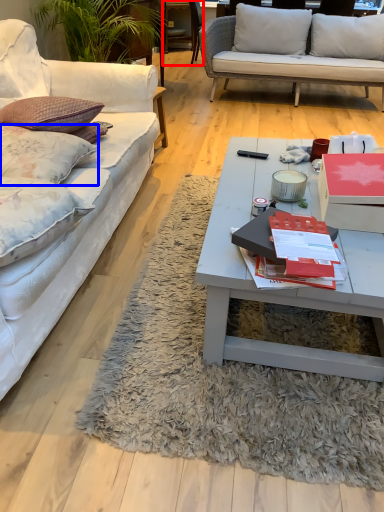
Question: Which object appears farthest to the camera in this image, chair (highlighted by a red box) or pillow (highlighted by a blue box)?

Choices:
 (A) chair
 (B) pillow

Answer: (A)